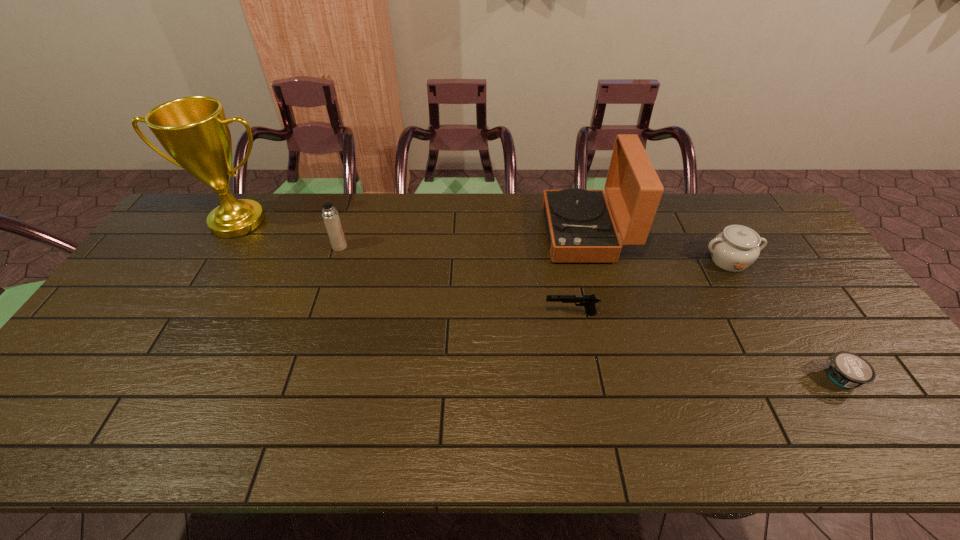
Image resolution: width=960 pixels, height=540 pixels. Identify the location of object that stands as the fifth closest to the shortest object. (194, 131).

The image size is (960, 540). Identify the location of vacant region that satisfies the following two spatial constraints: 1. on the face of the yogurt; 2. on the left side of the phonograph record. (623, 378).

Where is `vacant space that satisfies the following two spatial constraints: 1. at the aiming end of the nearest object; 2. on the left side of the gun`? This screenshot has height=540, width=960. vacant space that satisfies the following two spatial constraints: 1. at the aiming end of the nearest object; 2. on the left side of the gun is located at coordinates (583, 378).

Find the location of a particular element. The height and width of the screenshot is (540, 960). vacant space that satisfies the following two spatial constraints: 1. on the front side of the fourth tallest object; 2. at the aiming end of the gun is located at coordinates (758, 314).

Locate an element on the screen. vacant space that satisfies the following two spatial constraints: 1. at the aiming end of the second nearest object; 2. on the right side of the shortest object is located at coordinates (583, 378).

The width and height of the screenshot is (960, 540). Find the location of `vacant space that satisfies the following two spatial constraints: 1. at the aiming end of the second shortest object; 2. on the back side of the nearest object`. vacant space that satisfies the following two spatial constraints: 1. at the aiming end of the second shortest object; 2. on the back side of the nearest object is located at coordinates (583, 378).